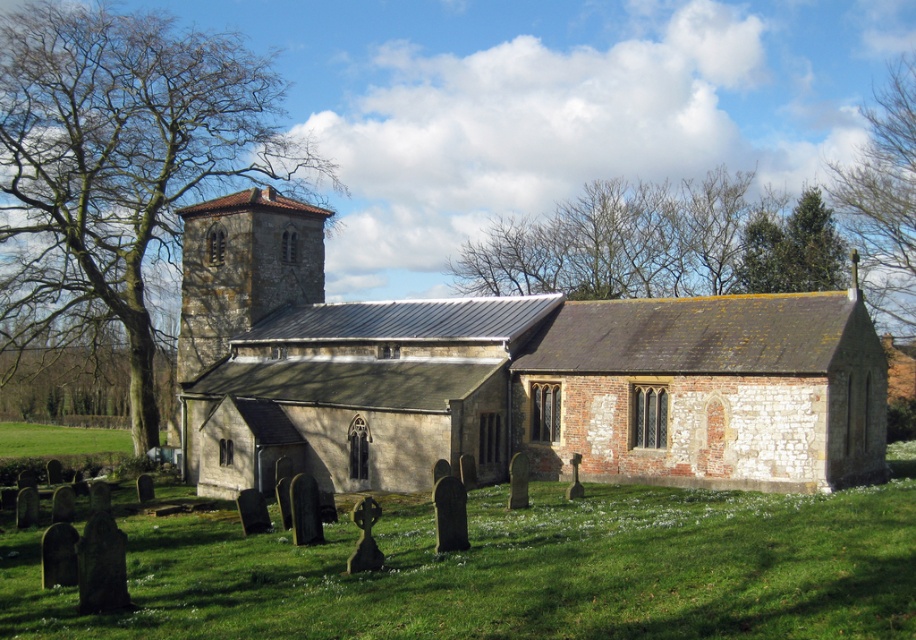
Who is more distant from viewer, (269,403) or (31,10)?

The point (31,10) is behind.

Find the location of a particular element. The image size is (916, 640). stone church at center is located at coordinates (505, 376).

Is green leafy tree at upper center thinner than green evergreen tree at upper right?

In fact, green leafy tree at upper center might be wider than green evergreen tree at upper right.

The image size is (916, 640). What do you see at coordinates (660, 243) in the screenshot?
I see `green leafy tree at upper center` at bounding box center [660, 243].

Does point (707, 216) come in front of point (795, 253)?

No, it is not.

Image resolution: width=916 pixels, height=640 pixels. In order to click on green leafy tree at upper center in this screenshot , I will do `click(660, 243)`.

From the picture: Is green leafy tree at upper center wider than green leafy tree at upper right?

Yes, green leafy tree at upper center is wider than green leafy tree at upper right.

Does green leafy tree at upper center appear on the left side of green leafy tree at upper right?

Indeed, green leafy tree at upper center is positioned on the left side of green leafy tree at upper right.

Who is more distant from viewer, (602,228) or (878,198)?

Positioned behind is point (602,228).

This screenshot has height=640, width=916. What are the coordinates of `green leafy tree at upper center` in the screenshot? It's located at (660, 243).